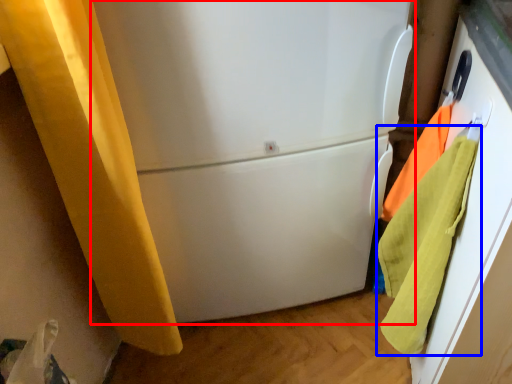
Question: Which object appears closest to the camera in this image, refrigerator (highlighted by a red box) or beach towel (highlighted by a blue box)?

Choices:
 (A) refrigerator
 (B) beach towel

Answer: (B)